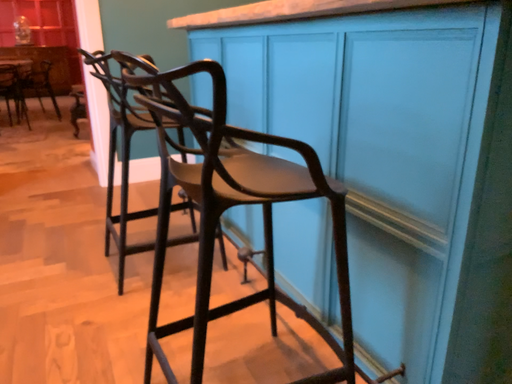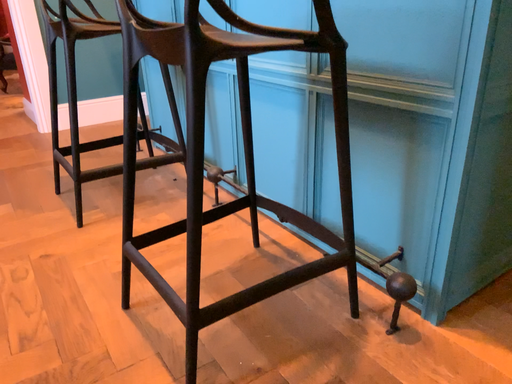
Question: Which way did the camera rotate in the video?

Choices:
 (A) rotated left
 (B) rotated right

Answer: (B)